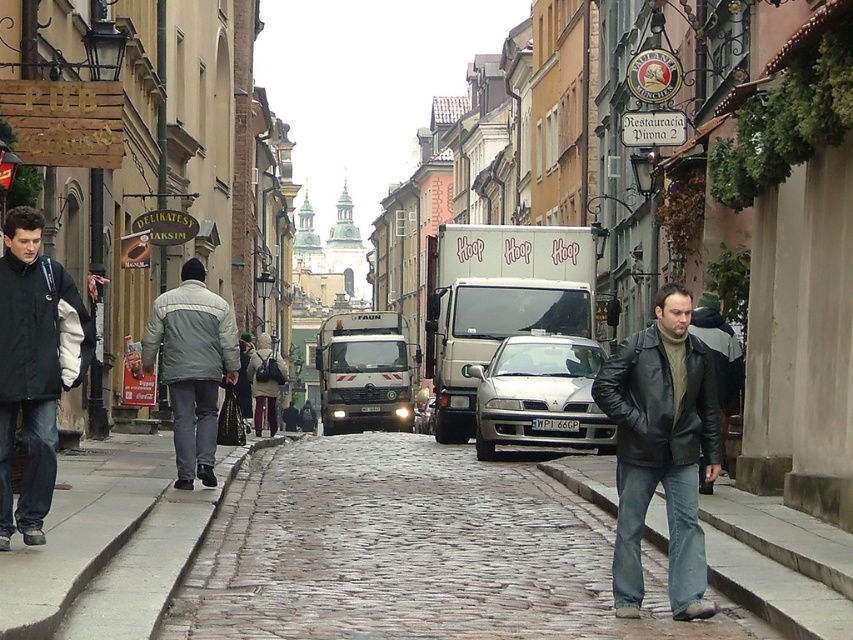
Consider the image. You are standing at the entrance of the PUB sign located on the left side of the street. You need to cross the street to reach the DELIKATESY MAKSIM store on the right side. Is there enough space between the silver metallic sedan at center and the buildings to safely cross without getting too close to the car?

The silver metallic sedan at center is positioned at coordinates (540, 396). Since the sedan is centrally located, there should be sufficient space between it and the buildings on either side of the street to allow safe crossing without coming too close to the car.

You are a delivery person who needs to load a large package into the trunk of the silver metallic sedan at center. The package is 1.8 meters tall. Considering the height of the leather jacket at right, can the package fit vertically in the trunk?

The silver metallic sedan at center is taller than the leather jacket at right. Since the leather jacket at right is likely shorter than the sedan, the package that is 1.8 meters tall may fit vertically in the trunk. However, without exact measurements of the sedan, it is uncertain. Please check the sedan dimensions.

You are standing on the cobblestone pavement at center and want to place a small box on the dark gray jacket at left. Can you do this without the box falling off?

The cobblestone pavement at center has a lesser height compared to dark gray jacket at left, so placing the box on the dark gray jacket at left will be stable as the jacket is higher.